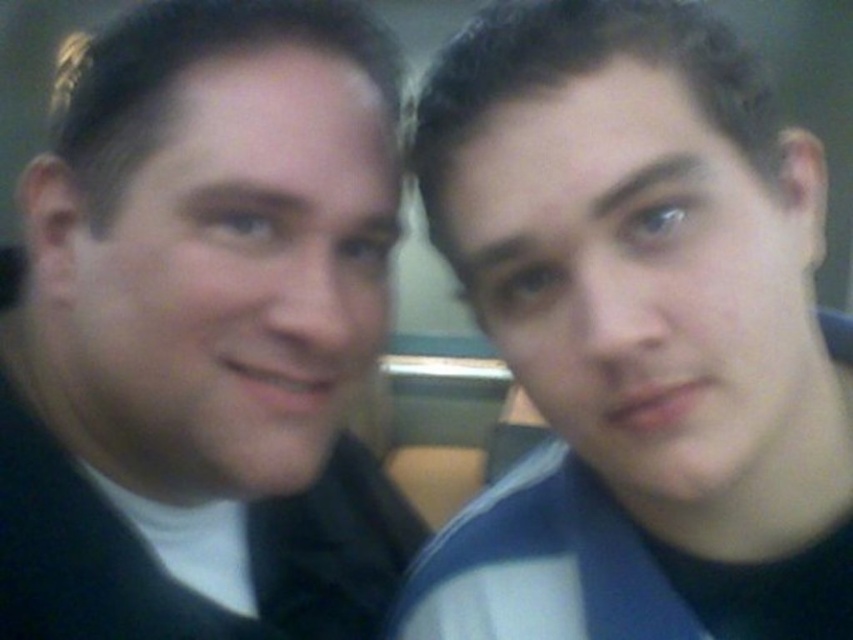
You are a photographer trying to adjust the lighting for a photo shoot. You notice the black matte suit at left and the blue striped shirt at right. Which object is positioned higher in the frame?

The black matte suit at left is located above the blue striped shirt at right, so it is positioned higher in the frame.

Looking at this image, you are standing in the scene and want to move from the point closer to you to the farther point. Which path would you take between the two points, point (334, 328) and point (665, 163)?

You should move from point (334, 328) to point (665, 163) because point (334, 328) is closer to you and you need to go to the farther point.

You are a photographer trying to frame two people for a photo. You see the black matte suit at left and the blue striped shirt at right. Which one is positioned more to the left side of the image?

The black matte suit at left is positioned more to the left side of the image than the blue striped shirt at right.